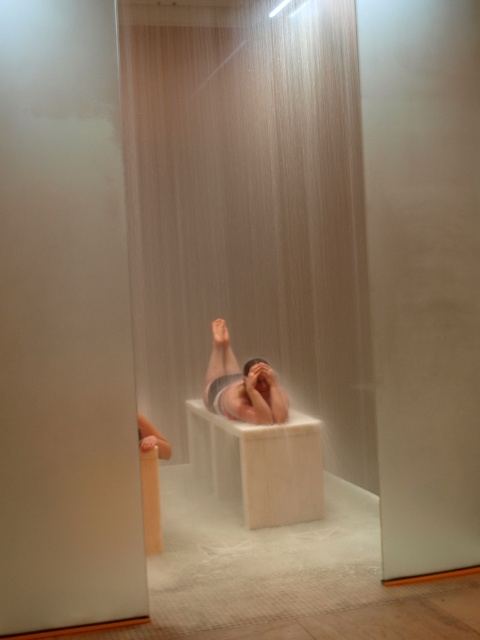
Between point (319, 497) and point (272, 417), which one is positioned behind?

Positioned behind is point (272, 417).

Is point (205, 467) closer to camera compared to point (247, 378)?

That is False.

The height and width of the screenshot is (640, 480). I want to click on white matte bath at center, so click(259, 465).